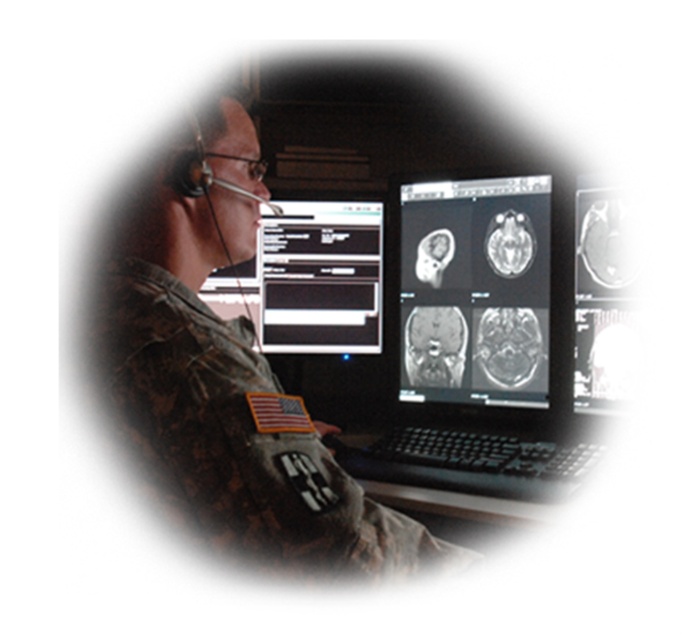
What do you see at coordinates (227, 374) in the screenshot? I see `camouflage uniform at center` at bounding box center [227, 374].

Does point (279, 563) come closer to viewer compared to point (416, 289)?

That is True.

Find the location of a particular element. The width and height of the screenshot is (685, 640). camouflage uniform at center is located at coordinates click(x=227, y=374).

Looking at this image, who is shorter, black matte brain scan at center or black glossy text box at center?

black glossy text box at center

Does point (427, 397) come behind point (347, 333)?

That is False.

Image resolution: width=685 pixels, height=640 pixels. I want to click on black matte brain scan at center, so click(x=475, y=291).

Is camouflage uniform at center bigger than black glossy text box at center?

Correct, camouflage uniform at center is larger in size than black glossy text box at center.

Is point (310, 481) farther from camera compared to point (266, 218)?

No, (310, 481) is closer to viewer.

Who is more forward, (240, 404) or (303, 243)?

Point (240, 404) is in front.

Where is `camouflage uniform at center`? This screenshot has height=640, width=685. camouflage uniform at center is located at coordinates (227, 374).